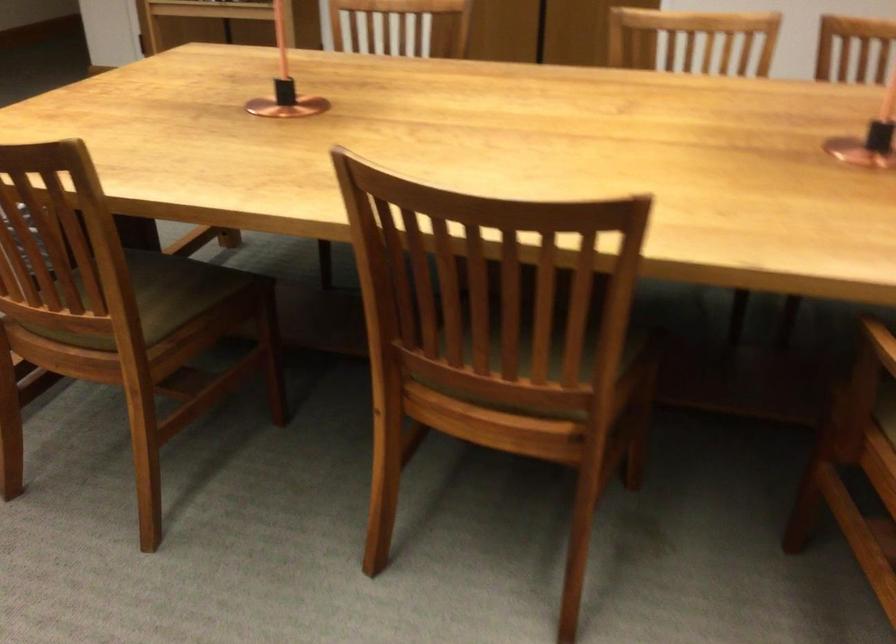
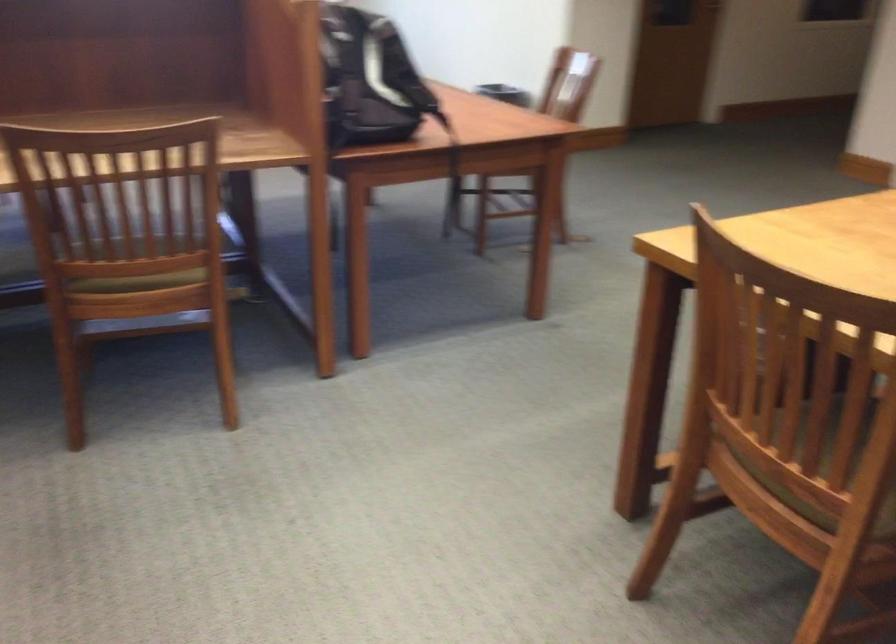
In the second image, find the point that corresponds to point 99,315 in the first image.

(823, 469)